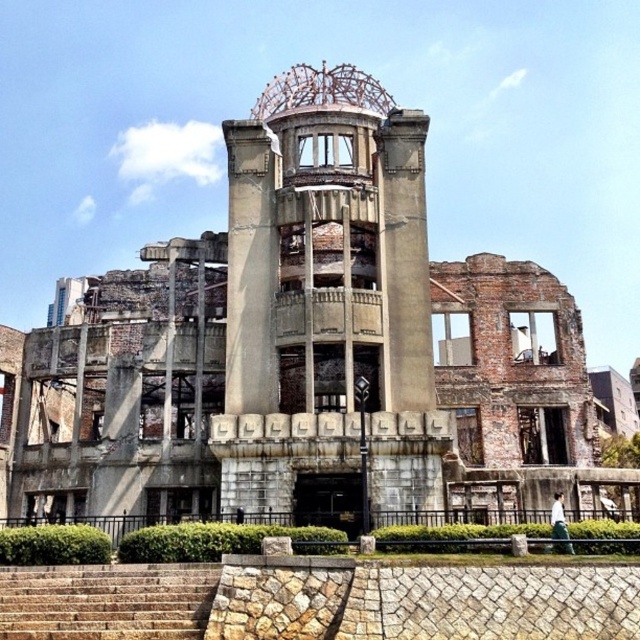
Question: Which object is farther from the camera taking this photo?

Choices:
 (A) brown stone stairs at lower left
 (B) concrete/rough column at center
 (C) concrete/stone bell tower at center

Answer: (B)

Question: Which object is the farthest from the concrete/stone bell tower at center?

Choices:
 (A) brown stone stairs at lower left
 (B) concrete/rough column at center

Answer: (A)

Question: Which of the following is the closest to the observer?

Choices:
 (A) concrete/stone bell tower at center
 (B) brown stone stairs at lower left

Answer: (B)

Question: Does concrete/stone bell tower at center appear over concrete/rough column at center?

Choices:
 (A) no
 (B) yes

Answer: (A)

Question: Is concrete/stone bell tower at center below concrete/rough column at center?

Choices:
 (A) yes
 (B) no

Answer: (A)

Question: Does concrete/stone bell tower at center have a smaller size compared to concrete/rough column at center?

Choices:
 (A) no
 (B) yes

Answer: (A)